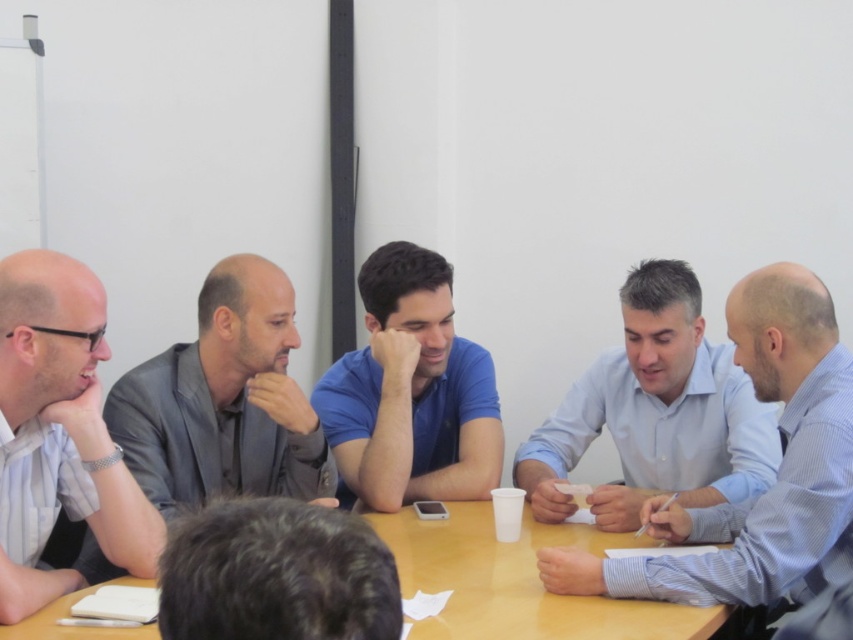
Question: Is blue cotton shirt at center thinner than light brown wood table at center?

Choices:
 (A) no
 (B) yes

Answer: (B)

Question: Which object appears farthest from the camera in this image?

Choices:
 (A) white shirt at left
 (B) blue cotton shirt at center
 (C) dark brown hair at center
 (D) gray fabric shirt at left

Answer: (B)

Question: Does gray fabric shirt at left have a greater width compared to dark brown hair at center?

Choices:
 (A) no
 (B) yes

Answer: (B)

Question: Observing the image, what is the correct spatial positioning of gray fabric shirt at left in reference to blue cotton shirt at center?

Choices:
 (A) right
 (B) left

Answer: (B)

Question: Which object is positioned farthest from the blue cotton shirt at center?

Choices:
 (A) light brown wood table at center
 (B) gray fabric shirt at left

Answer: (A)

Question: Among these objects, which one is nearest to the camera?

Choices:
 (A) dark brown hair at center
 (B) gray fabric shirt at left
 (C) blue shirt at center

Answer: (A)